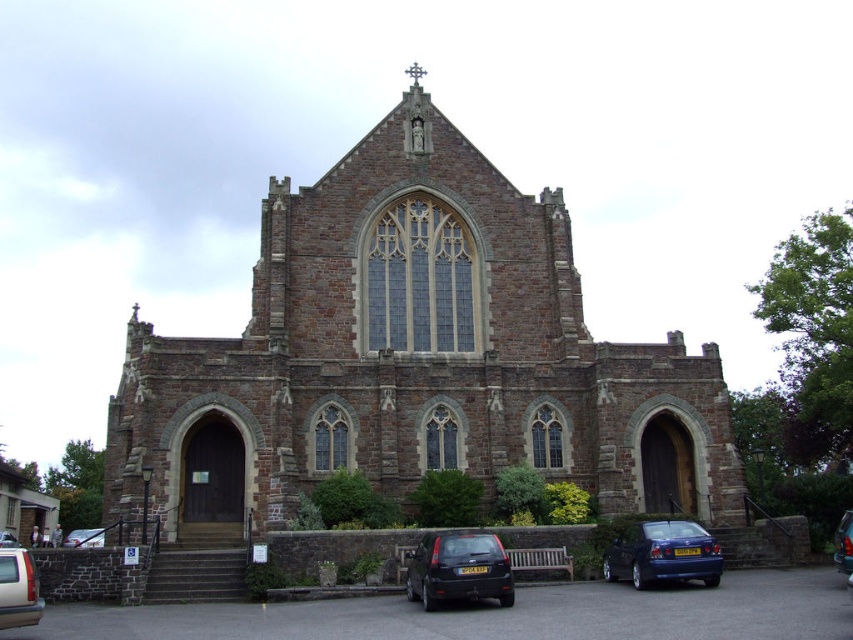
You are a photographer planning to capture both the brown stone church at center and the metallic blue sedan at center in a single shot. Given their relative sizes, which object should you focus on to ensure both are clearly visible in the frame?

The brown stone church at center is much taller than the metallic blue sedan at center. To ensure both are clearly visible, focus on the brown stone church at center as it occupies more vertical space, allowing the sedan to fit within the frame without cropping.

You are a pedestrian standing at the entrance of the stone church. You see a shiny blue sedan at lower right and a metallic silver car at lower left. Which car is closer to you?

The shiny blue sedan at lower right is closer to you because it is in front of the metallic silver car at lower left.